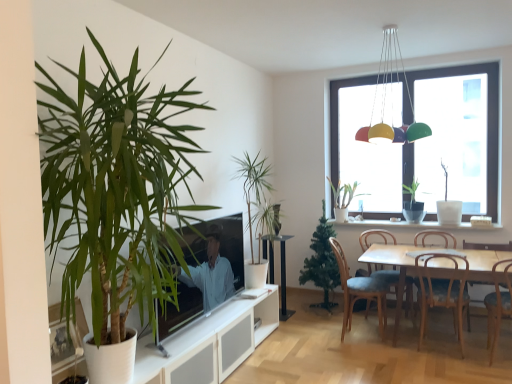
Identify the location of vacant space in front of black glass table at center. (289, 324).